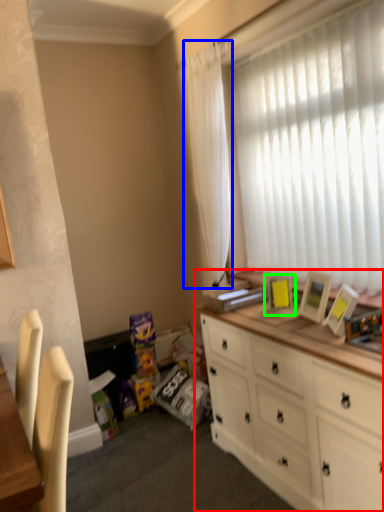
Question: Based on their relative distances, which object is nearer to cabinetry (highlighted by a red box)? Choose from curtain (highlighted by a blue box) and picture frame (highlighted by a green box).

Choices:
 (A) curtain
 (B) picture frame

Answer: (B)